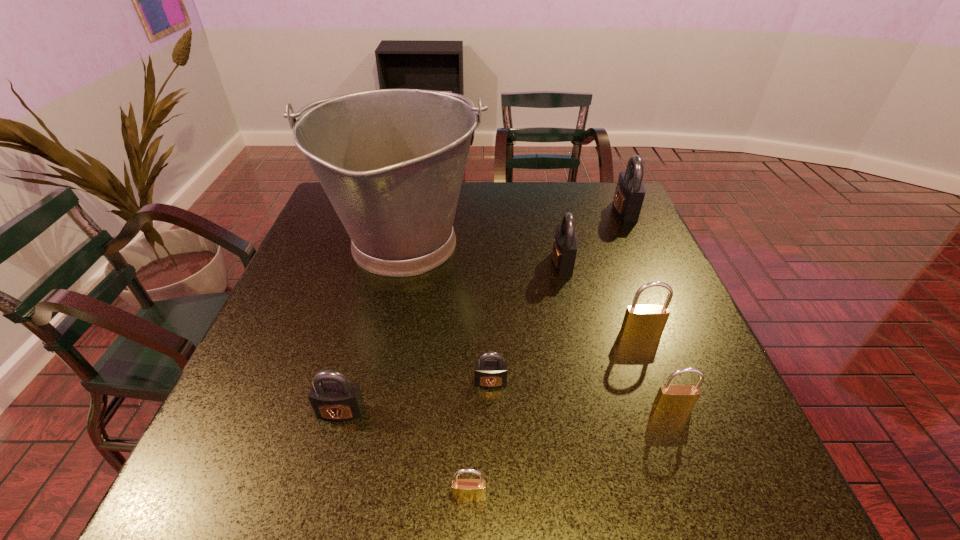
Where is `empty location between the biggest gray padlock and the leftmost gray padlock`? The width and height of the screenshot is (960, 540). empty location between the biggest gray padlock and the leftmost gray padlock is located at coordinates (483, 312).

Identify the location of free space between the second biggest brass padlock and the biggest brass padlock. The height and width of the screenshot is (540, 960). (657, 370).

This screenshot has width=960, height=540. I want to click on free point between the rightmost gray padlock and the fourth nearest object, so click(x=558, y=296).

Identify the location of blank region between the farthest padlock and the smallest brass padlock. The width and height of the screenshot is (960, 540). (547, 354).

This screenshot has height=540, width=960. Find the location of `the fifth closest object to the third farthest padlock`. the fifth closest object to the third farthest padlock is located at coordinates (630, 190).

Identify which object is the third closest to the farthest brass padlock. Please provide its 2D coordinates. Your answer should be formatted as a tuple, i.e. [(x, y)], where the tuple contains the x and y coordinates of a point satisfying the conditions above.

[(490, 374)]

Find the location of a particular element. padlock that is the sixth nearest to the leftmost brass padlock is located at coordinates (630, 190).

Image resolution: width=960 pixels, height=540 pixels. Identify the location of padlock that is the closest to the farthest gray padlock. (565, 244).

Locate an element on the screen. gray padlock that stands as the fourth closest to the nearest padlock is located at coordinates 630,190.

You are a GUI agent. You are given a task and a screenshot of the screen. Output one action in this format:
    pyautogui.click(x=<x>, y=<y>)
    Task: Click on the gray padlock that is the third closest to the second farthest padlock
    Image resolution: width=960 pixels, height=540 pixels.
    Given the screenshot: What is the action you would take?
    pyautogui.click(x=339, y=400)